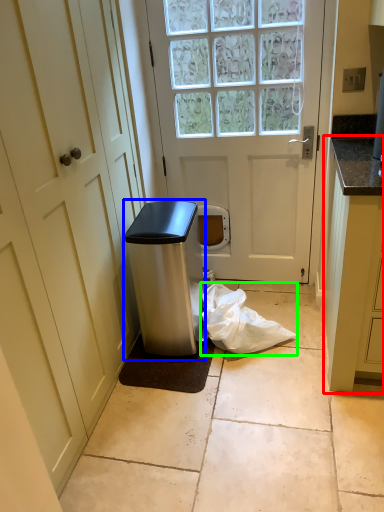
Question: Estimate the real-world distances between objects in this image. Which object is farther from cabinetry (highlighted by a red box), appliance (highlighted by a blue box) or plastic bag (highlighted by a green box)?

Choices:
 (A) appliance
 (B) plastic bag

Answer: (A)